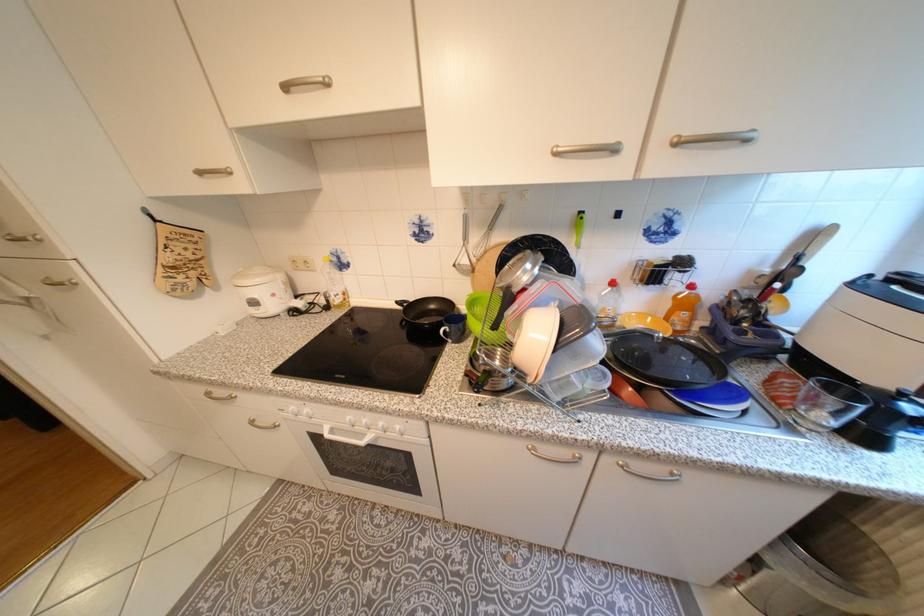
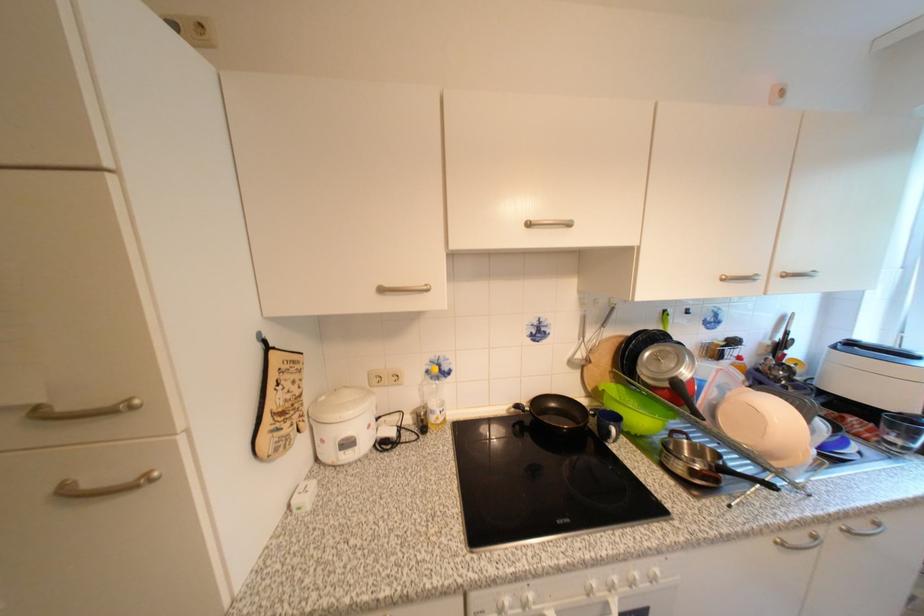
Question: What movement of the cameraman would produce the second image?

Choices:
 (A) Left
 (B) Right
 (C) Forward
 (D) Backward

Answer: (A)